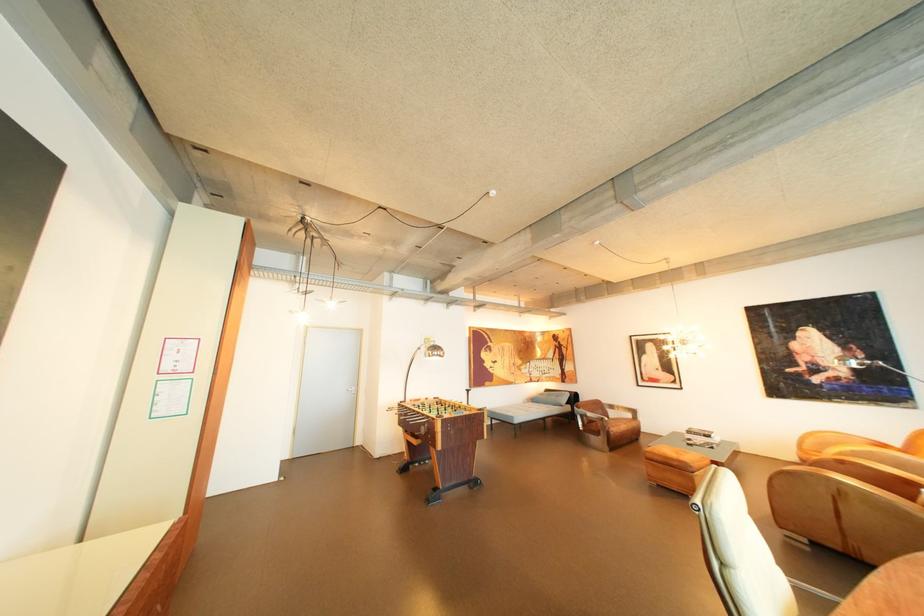
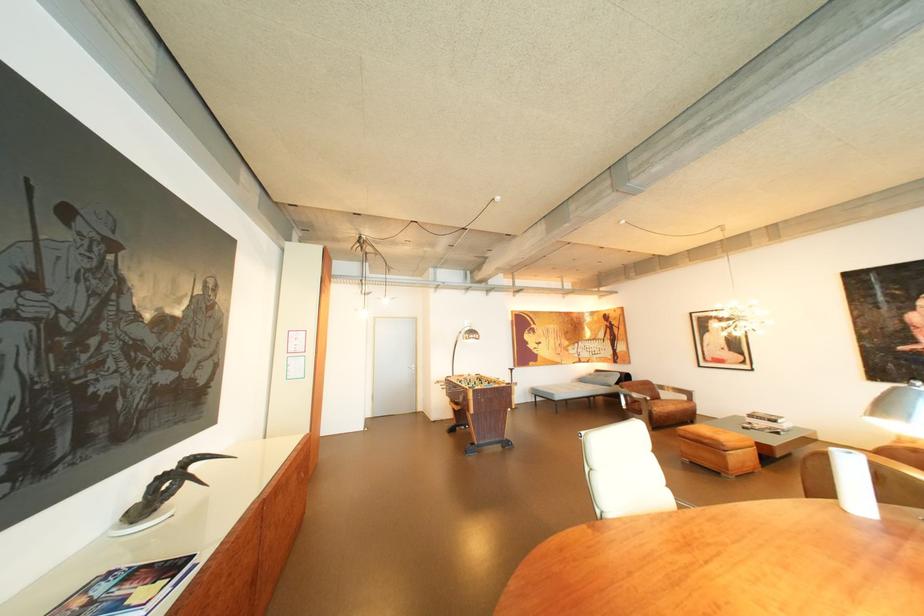
Question: The images are taken continuously from a first-person perspective. In which direction is your viewpoint rotating?

Choices:
 (A) Left
 (B) Right
 (C) Up
 (D) Down

Answer: (A)